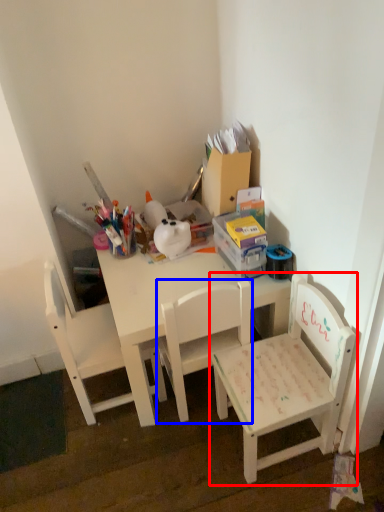
Question: Which point is closer to the camera, chair (highlighted by a red box) or chair (highlighted by a blue box)?

Choices:
 (A) chair
 (B) chair

Answer: (A)